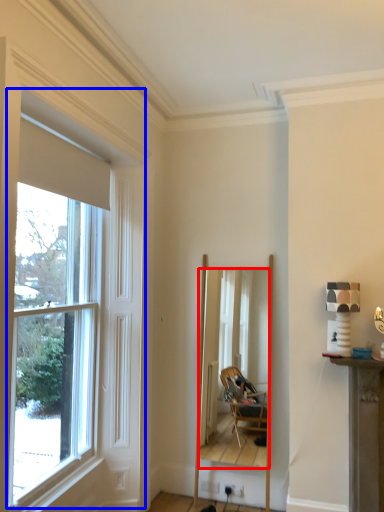
Question: Which point is closer to the camera, mirror (highlighted by a red box) or window (highlighted by a blue box)?

Choices:
 (A) mirror
 (B) window

Answer: (B)